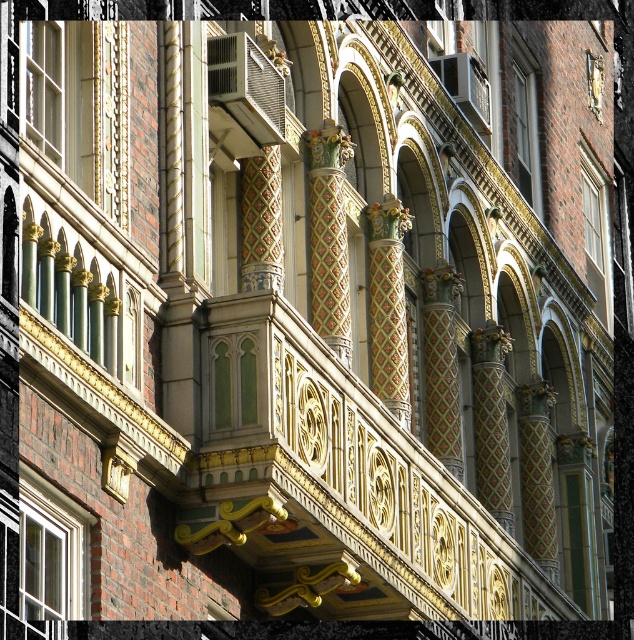
Does matte glass window at upper center lie behind white painted wood window at upper right?

No.

The height and width of the screenshot is (640, 634). Identify the location of matte glass window at upper center. (522, 122).

Is point (517, 131) closer to viewer compared to point (592, 161)?

Yes, point (517, 131) is closer to viewer.

You are a GUI agent. You are given a task and a screenshot of the screen. Output one action in this format:
    pyautogui.click(x=<x>, y=<y>)
    Task: Click on the matte glass window at upper center
    The width and height of the screenshot is (634, 640).
    Given the screenshot: What is the action you would take?
    click(522, 122)

Does point (75, 584) lie in front of point (590, 161)?

That is True.

Can you confirm if white glossy window at lower left is positioned above white painted wood window at upper right?

Incorrect, white glossy window at lower left is not positioned above white painted wood window at upper right.

Between point (55, 568) and point (607, 321), which one is positioned in front?

Point (55, 568) is more forward.

What are the coordinates of `white glossy window at lower left` in the screenshot? It's located at click(48, 563).

Does matte glass window at upper left appear on the right side of white glossy window at lower left?

Indeed, matte glass window at upper left is positioned on the right side of white glossy window at lower left.

Does matte glass window at upper left have a lesser width compared to white glossy window at lower left?

Incorrect, matte glass window at upper left's width is not less than white glossy window at lower left's.

The height and width of the screenshot is (640, 634). What do you see at coordinates (79, 104) in the screenshot?
I see `matte glass window at upper left` at bounding box center [79, 104].

Locate an element on the screen. The image size is (634, 640). matte glass window at upper left is located at coordinates (79, 104).